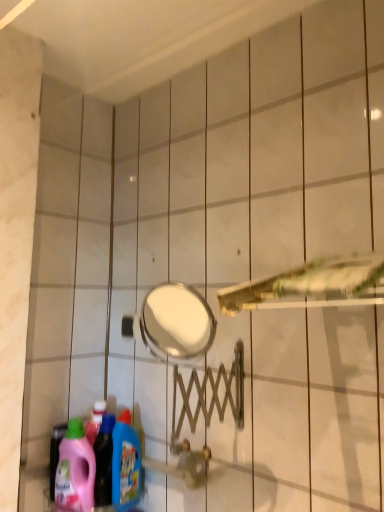
Question: Is pink plastic detergent at lower left, the first cleaning product in the left-to-right sequence, not inside blue glossy detergent at lower left, arranged as the first cleaning product when viewed from the right?

Choices:
 (A) no
 (B) yes

Answer: (B)

Question: From the image's perspective, is pink plastic detergent at lower left, the first cleaning product in the left-to-right sequence, over blue glossy detergent at lower left, the second cleaning product viewed from the left?

Choices:
 (A) no
 (B) yes

Answer: (A)

Question: Is the position of pink plastic detergent at lower left, which is the 2th cleaning product from right to left, less distant than that of blue glossy detergent at lower left, the second cleaning product viewed from the left?

Choices:
 (A) no
 (B) yes

Answer: (B)

Question: From a real-world perspective, is pink plastic detergent at lower left, which is the 2th cleaning product from right to left, under blue glossy detergent at lower left, the second cleaning product viewed from the left?

Choices:
 (A) no
 (B) yes

Answer: (B)

Question: Are pink plastic detergent at lower left, which is the 2th cleaning product from right to left, and blue glossy detergent at lower left, the second cleaning product viewed from the left, beside each other?

Choices:
 (A) no
 (B) yes

Answer: (A)

Question: Can you confirm if pink plastic detergent at lower left, the first cleaning product in the left-to-right sequence, is taller than blue glossy detergent at lower left, arranged as the first cleaning product when viewed from the right?

Choices:
 (A) yes
 (B) no

Answer: (B)

Question: Is metallic gold shower head at center at the right side of blue glossy detergent at lower left, the second cleaning product viewed from the left?

Choices:
 (A) yes
 (B) no

Answer: (A)

Question: From a real-world perspective, is metallic gold shower head at center under blue glossy detergent at lower left, arranged as the first cleaning product when viewed from the right?

Choices:
 (A) yes
 (B) no

Answer: (B)

Question: Does metallic gold shower head at center come in front of blue glossy detergent at lower left, the second cleaning product viewed from the left?

Choices:
 (A) no
 (B) yes

Answer: (B)

Question: Does metallic gold shower head at center have a lesser width compared to blue glossy detergent at lower left, the second cleaning product viewed from the left?

Choices:
 (A) yes
 (B) no

Answer: (B)

Question: Is metallic gold shower head at center to the left of blue glossy detergent at lower left, the second cleaning product viewed from the left, from the viewer's perspective?

Choices:
 (A) yes
 (B) no

Answer: (B)

Question: Is metallic gold shower head at center wider than blue glossy detergent at lower left, the second cleaning product viewed from the left?

Choices:
 (A) no
 (B) yes

Answer: (B)

Question: Can you confirm if blue glossy detergent at lower left, the second cleaning product viewed from the left, is positioned to the right of pink plastic detergent at lower left, the first cleaning product in the left-to-right sequence?

Choices:
 (A) yes
 (B) no

Answer: (A)